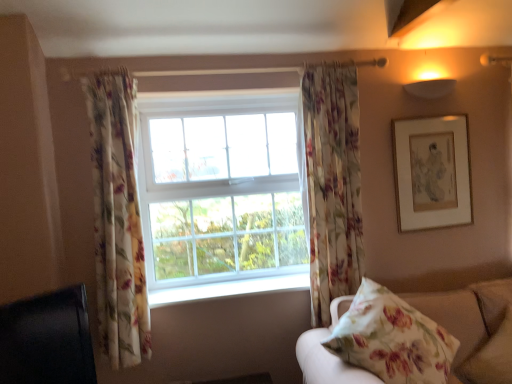
Question: From a real-world perspective, is floral fabric curtain at center, arranged as the second curtain when viewed from the left, over white smooth window sill at center?

Choices:
 (A) yes
 (B) no

Answer: (A)

Question: Is floral fabric curtain at center, arranged as the second curtain when viewed from the left, further to the viewer compared to white smooth window sill at center?

Choices:
 (A) no
 (B) yes

Answer: (A)

Question: Is floral fabric curtain at center, arranged as the second curtain when viewed from the left, positioned in front of white smooth window sill at center?

Choices:
 (A) no
 (B) yes

Answer: (B)

Question: Does floral fabric curtain at center, positioned as the 1th curtain in right-to-left order, have a greater width compared to white smooth window sill at center?

Choices:
 (A) yes
 (B) no

Answer: (B)

Question: Considering the relative sizes of floral fabric curtain at center, arranged as the second curtain when viewed from the left, and white smooth window sill at center in the image provided, is floral fabric curtain at center, arranged as the second curtain when viewed from the left, bigger than white smooth window sill at center?

Choices:
 (A) no
 (B) yes

Answer: (B)

Question: Is floral fabric curtain at center, positioned as the 1th curtain in right-to-left order, in front of or behind white smooth window sill at center in the image?

Choices:
 (A) front
 (B) behind

Answer: (A)

Question: Considering the positions of floral fabric curtain at center, positioned as the 1th curtain in right-to-left order, and white smooth window sill at center in the image, is floral fabric curtain at center, positioned as the 1th curtain in right-to-left order, bigger or smaller than white smooth window sill at center?

Choices:
 (A) small
 (B) big

Answer: (B)

Question: Does point (309, 193) appear closer or farther from the camera than point (192, 291)?

Choices:
 (A) closer
 (B) farther

Answer: (A)

Question: Is floral fabric curtain at center, arranged as the second curtain when viewed from the left, spatially inside white smooth window sill at center, or outside of it?

Choices:
 (A) inside
 (B) outside

Answer: (B)

Question: Is white smooth window sill at center bigger or smaller than gold-framed artwork at upper right?

Choices:
 (A) big
 (B) small

Answer: (B)

Question: Based on their positions, is white smooth window sill at center located to the left or right of gold-framed artwork at upper right?

Choices:
 (A) right
 (B) left

Answer: (B)

Question: Does point (239, 294) appear closer or farther from the camera than point (437, 178)?

Choices:
 (A) closer
 (B) farther

Answer: (A)

Question: Looking at their shapes, would you say white smooth window sill at center is wider or thinner than gold-framed artwork at upper right?

Choices:
 (A) wide
 (B) thin

Answer: (A)

Question: Does point (125, 340) appear closer or farther from the camera than point (307, 125)?

Choices:
 (A) closer
 (B) farther

Answer: (A)

Question: Is floral fabric curtain at left, positioned as the second curtain in right-to-left order, wider or thinner than floral fabric curtain at center, positioned as the 1th curtain in right-to-left order?

Choices:
 (A) thin
 (B) wide

Answer: (B)